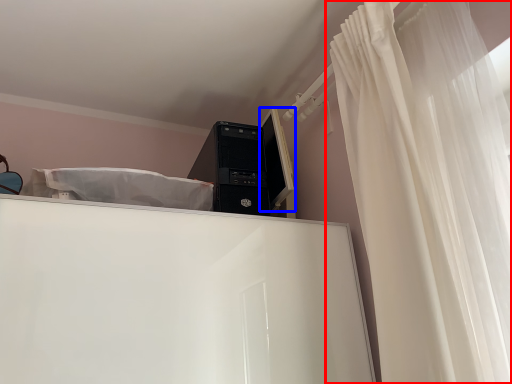
Question: Which of the following is the farthest to the observer, curtain (highlighted by a red box) or computer monitor (highlighted by a blue box)?

Choices:
 (A) curtain
 (B) computer monitor

Answer: (B)